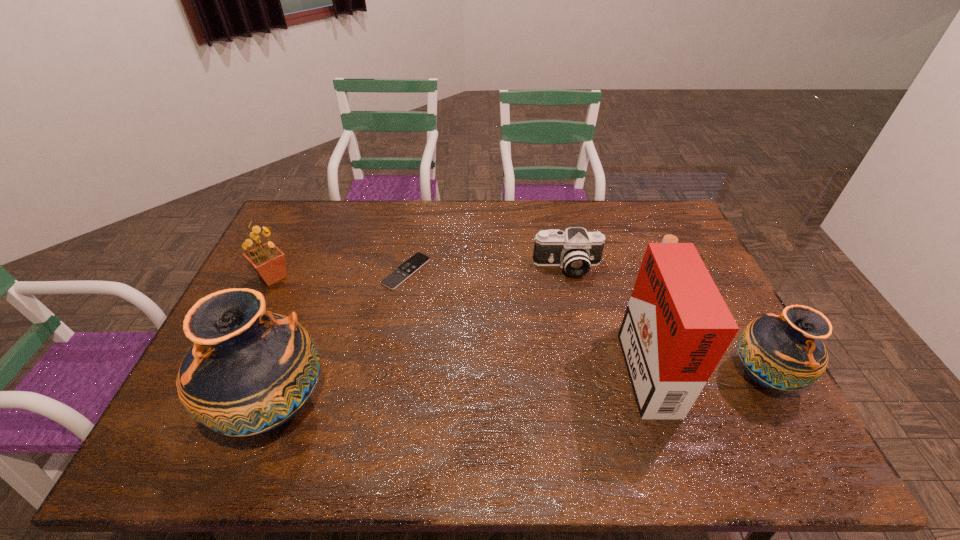
The height and width of the screenshot is (540, 960). Identify the location of vacant space that is in between the third object from left to right and the cigarette case. (525, 318).

The height and width of the screenshot is (540, 960). What are the coordinates of `free space between the cigarette case and the taller pottery` in the screenshot? It's located at (460, 386).

Locate an element on the screen. This screenshot has height=540, width=960. empty space that is in between the right pottery and the left pottery is located at coordinates (518, 392).

I want to click on free space between the sunflower and the cigarette case, so click(x=459, y=320).

The width and height of the screenshot is (960, 540). Identify the location of empty space that is in between the cigarette case and the left pottery. (460, 386).

Locate which object ranks in proximity to the cigarette case. Please provide its 2D coordinates. Your answer should be formatted as a tuple, i.e. [(x, y)], where the tuple contains the x and y coordinates of a point satisfying the conditions above.

[(785, 352)]

Find the location of a particular element. This screenshot has height=540, width=960. object that can be found as the fifth closest to the sunflower is located at coordinates (785, 352).

At what (x,y) coordinates should I click in order to perform the action: click on vacant area that satisfies the following two spatial constraints: 1. at the front of the sunflower with flowers visible; 2. on the back side of the taller pottery. Please return your answer as a coordinate pair (x, y). Looking at the image, I should click on (209, 407).

Find the location of a particular element. This screenshot has height=540, width=960. vacant area in the image that satisfies the following two spatial constraints: 1. at the front of the sunflower with flowers visible; 2. on the right side of the rightmost object is located at coordinates (225, 376).

You are a GUI agent. You are given a task and a screenshot of the screen. Output one action in this format:
    pyautogui.click(x=<x>, y=<y>)
    Task: Click on the free location that satisfies the following two spatial constraints: 1. at the front of the shorter pottery with flowers visible; 2. on the left side of the sunflower
    This screenshot has height=540, width=960.
    Given the screenshot: What is the action you would take?
    pyautogui.click(x=225, y=376)